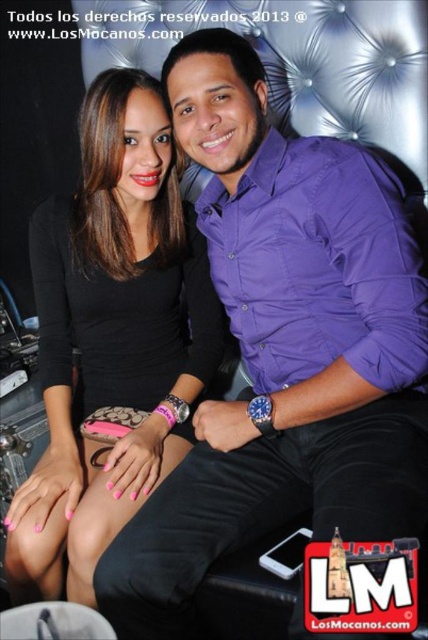
Question: Which object appears closest to the camera in this image?

Choices:
 (A) black matte dress at center
 (B) purple satin shirt at center

Answer: (B)

Question: Does purple satin shirt at center have a larger size compared to black matte dress at center?

Choices:
 (A) yes
 (B) no

Answer: (A)

Question: Can you confirm if purple satin shirt at center is wider than black matte dress at center?

Choices:
 (A) no
 (B) yes

Answer: (B)

Question: Is purple satin shirt at center below black matte dress at center?

Choices:
 (A) no
 (B) yes

Answer: (A)